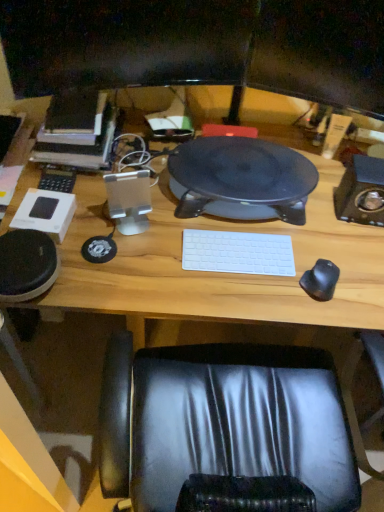
Locate an element on the screen. vacant area that lies in front of white matte keyboard at center is located at coordinates (231, 295).